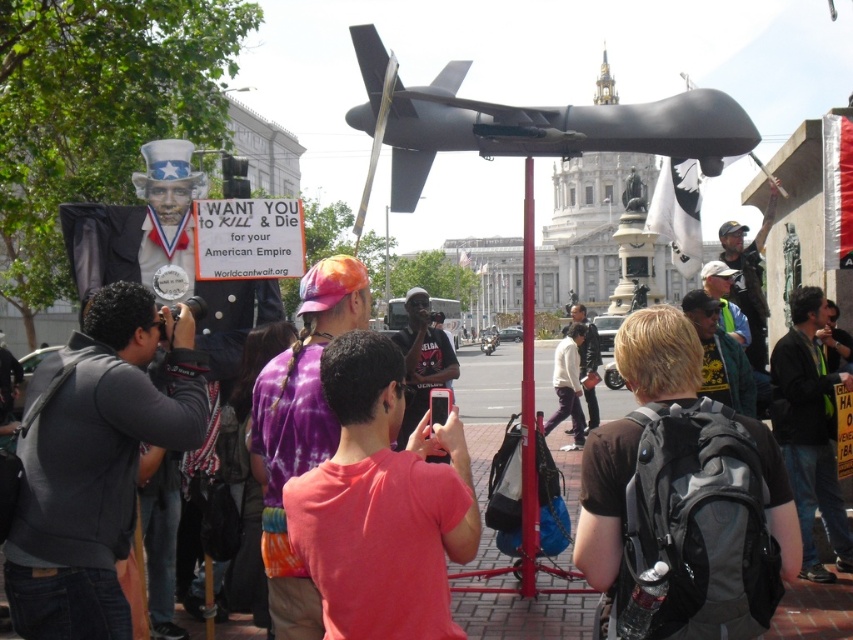
Question: Among these points, which one is nearest to the camera?

Choices:
 (A) (78, 419)
 (B) (715, 269)
 (C) (645, 376)

Answer: (A)

Question: Which of the following is the farthest from the observer?

Choices:
 (A) gray fleece jacket at lower left
 (B) black backpack at center
 (C) purple tie-dye wig at center
 (D) purple tie-dye shirt at center

Answer: (C)

Question: Which point appears farthest from the camera in this image?

Choices:
 (A) (729, 396)
 (B) (137, 330)

Answer: (A)

Question: Is dark gray hoodie at lower right positioned before brown fuzzy wig at upper right?

Choices:
 (A) no
 (B) yes

Answer: (B)

Question: Does dark gray hoodie at lower right have a smaller size compared to yellow-green fabric at center?

Choices:
 (A) no
 (B) yes

Answer: (A)

Question: Can you confirm if dark gray hoodie at lower right is positioned above brown fuzzy wig at upper right?

Choices:
 (A) no
 (B) yes

Answer: (A)